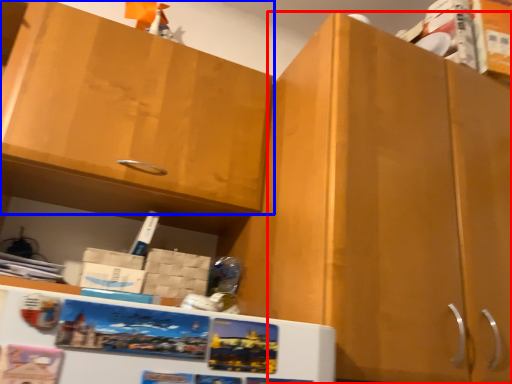
Question: Which object appears farthest to the camera in this image, cabinetry (highlighted by a red box) or cabinetry (highlighted by a blue box)?

Choices:
 (A) cabinetry
 (B) cabinetry

Answer: (B)